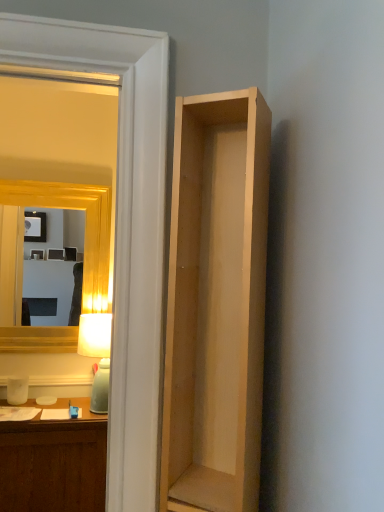
Question: Considering the relative sizes of transparent glass door at upper left and natural wood shelf at right in the image provided, is transparent glass door at upper left thinner than natural wood shelf at right?

Choices:
 (A) yes
 (B) no

Answer: (A)

Question: Does transparent glass door at upper left have a smaller size compared to natural wood shelf at right?

Choices:
 (A) yes
 (B) no

Answer: (A)

Question: Is transparent glass door at upper left looking in the opposite direction of natural wood shelf at right?

Choices:
 (A) no
 (B) yes

Answer: (A)

Question: Is transparent glass door at upper left oriented towards natural wood shelf at right?

Choices:
 (A) no
 (B) yes

Answer: (A)

Question: Is the depth of transparent glass door at upper left greater than that of natural wood shelf at right?

Choices:
 (A) yes
 (B) no

Answer: (A)

Question: From a real-world perspective, is transparent glass door at upper left located higher than natural wood shelf at right?

Choices:
 (A) yes
 (B) no

Answer: (A)

Question: Does gold wooden mirror at upper left appear on the right side of transparent glass door at upper left?

Choices:
 (A) no
 (B) yes

Answer: (A)

Question: Considering the relative sizes of gold wooden mirror at upper left and transparent glass door at upper left in the image provided, is gold wooden mirror at upper left taller than transparent glass door at upper left?

Choices:
 (A) yes
 (B) no

Answer: (B)

Question: Is gold wooden mirror at upper left bigger than transparent glass door at upper left?

Choices:
 (A) no
 (B) yes

Answer: (B)

Question: Does gold wooden mirror at upper left have a greater width compared to transparent glass door at upper left?

Choices:
 (A) yes
 (B) no

Answer: (B)

Question: From a real-world perspective, is gold wooden mirror at upper left over transparent glass door at upper left?

Choices:
 (A) yes
 (B) no

Answer: (B)

Question: From the image's perspective, does gold wooden mirror at upper left appear lower than transparent glass door at upper left?

Choices:
 (A) yes
 (B) no

Answer: (A)

Question: Considering the relative positions of gold wooden mirror at upper left and matte white lamp at left in the image provided, is gold wooden mirror at upper left to the left of matte white lamp at left from the viewer's perspective?

Choices:
 (A) no
 (B) yes

Answer: (B)